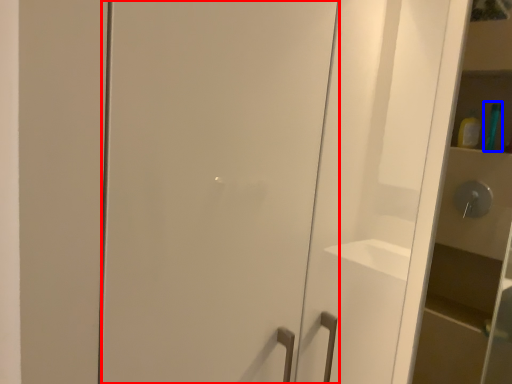
Question: Which point is further to the camera, door (highlighted by a red box) or toiletry (highlighted by a blue box)?

Choices:
 (A) door
 (B) toiletry

Answer: (B)